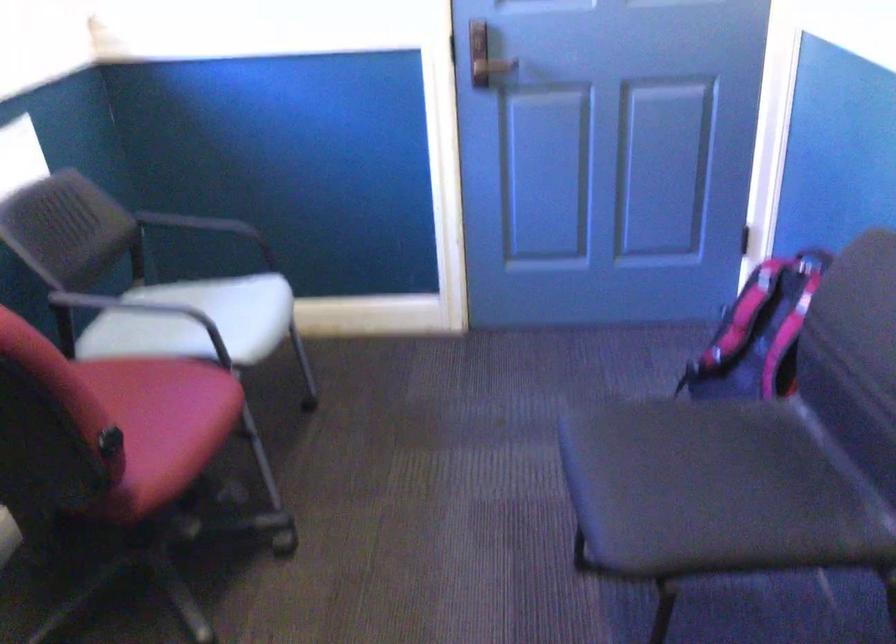
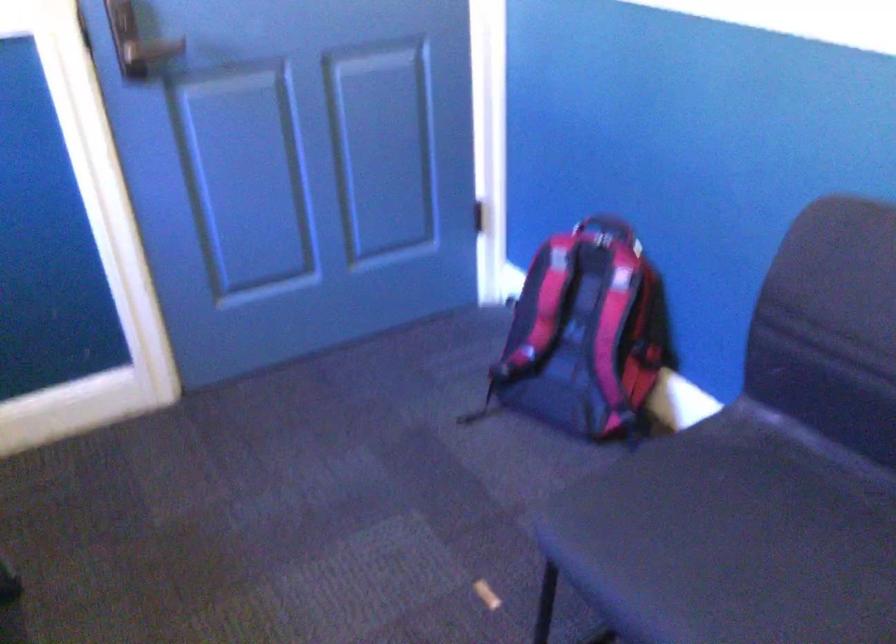
Question: The camera is either moving clockwise (left) or counter-clockwise (right) around the object. The first image is from the beginning of the video and the second image is from the end. Is the camera moving left or right when shooting the video?

Choices:
 (A) Left
 (B) Right

Answer: (A)